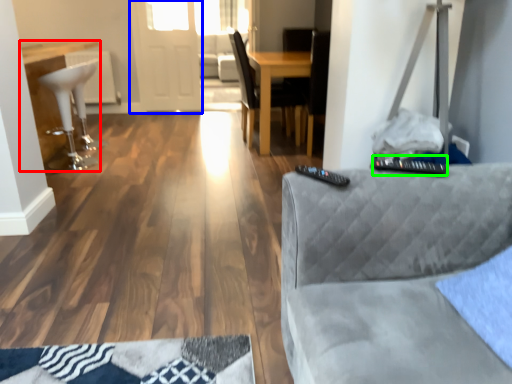
Question: Considering the real-world distances, which object is farthest from table (highlighted by a red box)? glass door (highlighted by a blue box) or control (highlighted by a green box)?

Choices:
 (A) glass door
 (B) control

Answer: (B)